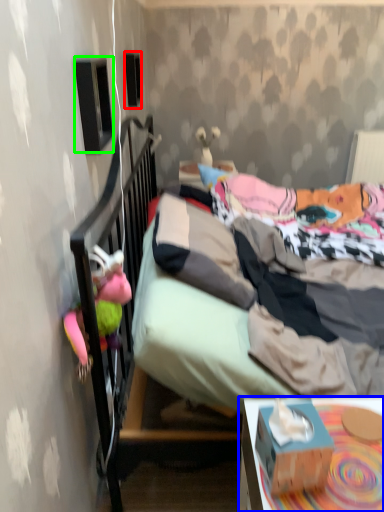
Question: Which object is the farthest from loudspeaker (highlighted by a red box)? Choose among these: desk (highlighted by a blue box) or loudspeaker (highlighted by a green box).

Choices:
 (A) desk
 (B) loudspeaker

Answer: (A)